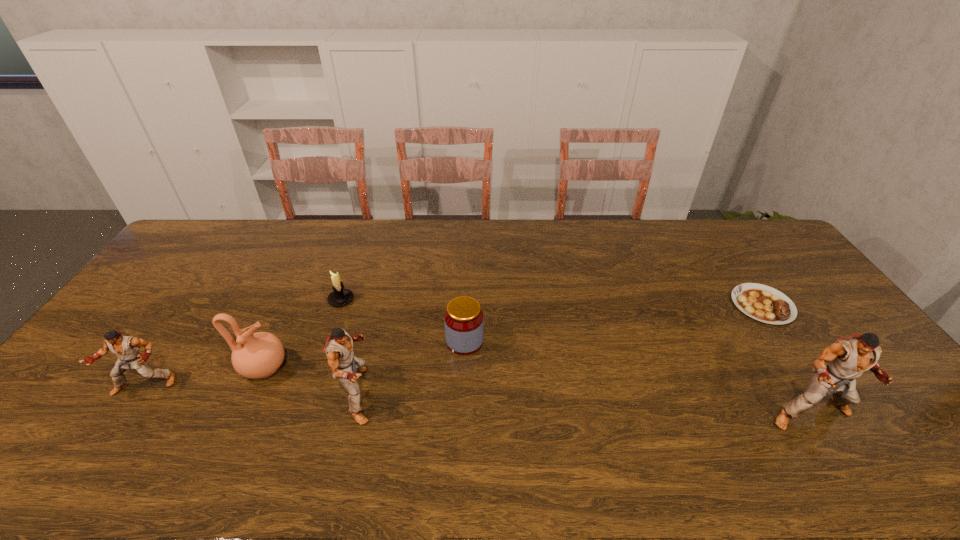
Where is `the leftmost object`? Image resolution: width=960 pixels, height=540 pixels. the leftmost object is located at coordinates (126, 348).

Find the location of a particular element. This screenshot has height=540, width=960. the shortest puncher is located at coordinates (126, 348).

At what (x,y) coordinates should I click in order to perform the action: click on the fourth object from left to right. Please return your answer as a coordinate pair (x, y). Image resolution: width=960 pixels, height=540 pixels. Looking at the image, I should click on (339, 345).

Find the location of a particular element. This screenshot has height=540, width=960. the second puncher from left to right is located at coordinates pos(339,345).

This screenshot has height=540, width=960. I want to click on the rightmost puncher, so click(848, 358).

This screenshot has width=960, height=540. What are the coordinates of `candle holder` in the screenshot? It's located at (339, 297).

The height and width of the screenshot is (540, 960). In order to click on the shortest object in this screenshot , I will do `click(763, 303)`.

Find the location of a particular element. jar is located at coordinates (464, 322).

Where is `the sixth object from right to left`? the sixth object from right to left is located at coordinates (256, 355).

Where is `vacant space located 0.080m on the front-facing side of the shortest puncher`? The width and height of the screenshot is (960, 540). vacant space located 0.080m on the front-facing side of the shortest puncher is located at coordinates (116, 427).